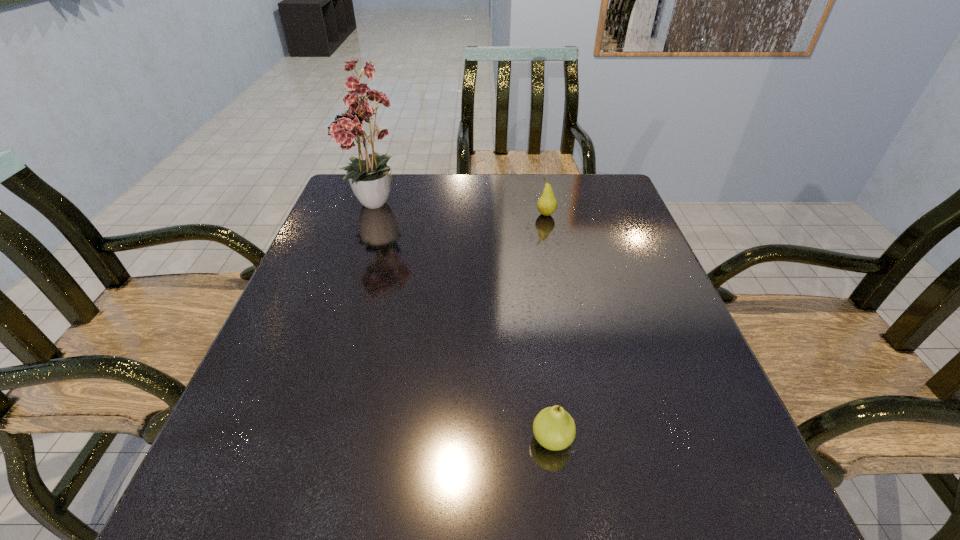
This screenshot has width=960, height=540. I want to click on the second closest object to the rightmost object, so click(554, 428).

This screenshot has height=540, width=960. I want to click on object that is the closest one to the tallest object, so coord(547,204).

The height and width of the screenshot is (540, 960). I want to click on vacant space that satisfies the following two spatial constraints: 1. on the front-facing side of the second object from right to left; 2. on the left side of the leftmost object, so click(300, 439).

Locate an element on the screen. The width and height of the screenshot is (960, 540). free space that satisfies the following two spatial constraints: 1. on the front-facing side of the nearer pear; 2. on the left side of the tallest object is located at coordinates (300, 439).

This screenshot has width=960, height=540. Identify the location of vacant region that satisfies the following two spatial constraints: 1. on the front-facing side of the farther pear; 2. on the right side of the leftmost object. (373, 214).

The image size is (960, 540). What are the coordinates of `free space that satisfies the following two spatial constraints: 1. on the front-facing side of the flower arrangement; 2. on the left side of the nearest object` in the screenshot? It's located at (300, 439).

Find the location of a particular element. The image size is (960, 540). vacant space that satisfies the following two spatial constraints: 1. on the front-facing side of the tallest object; 2. on the left side of the farther pear is located at coordinates (373, 214).

Where is `free space in the image that satisfies the following two spatial constraints: 1. on the front-facing side of the right pear; 2. on the right side of the tallest object`? The height and width of the screenshot is (540, 960). free space in the image that satisfies the following two spatial constraints: 1. on the front-facing side of the right pear; 2. on the right side of the tallest object is located at coordinates (373, 214).

Locate an element on the screen. Image resolution: width=960 pixels, height=540 pixels. free point that satisfies the following two spatial constraints: 1. on the back side of the right pear; 2. on the right side of the second object from right to left is located at coordinates (522, 214).